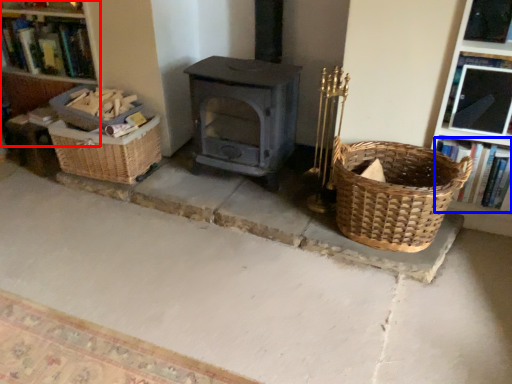
Question: Which object appears farthest to the camera in this image, bookshelf (highlighted by a red box) or book (highlighted by a blue box)?

Choices:
 (A) bookshelf
 (B) book

Answer: (A)